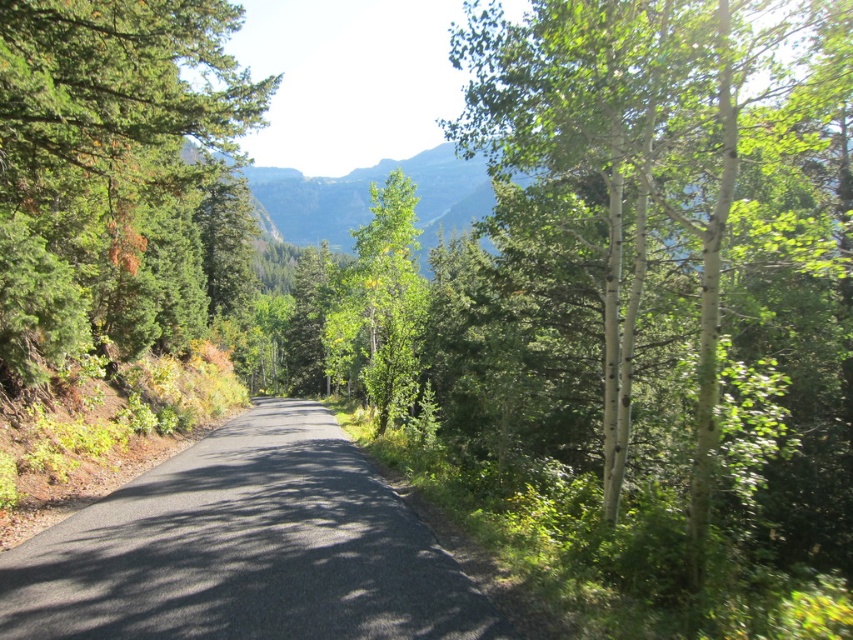
You are standing at the starting point of the forest road and see the point marked at coordinates (694, 209). Which direction should you walk to reach the white bark tree at right?

The point at (694, 209) indicates the location of the white bark tree at right, so you should walk towards that point to reach it.

You are a hiker standing on the forest road. You notice a white bark tree at right and a green matte tree at left. Which tree would cast a longer shadow on the road?

The white bark tree at right is taller than the green matte tree at left, so it would cast a longer shadow on the road.

You are standing on the forest road and want to walk towards the two points marked in the scene. Which point, point [20,252] or point [405,211], is closer to you?

Point [20,252] is closer to the viewer than point [405,211].